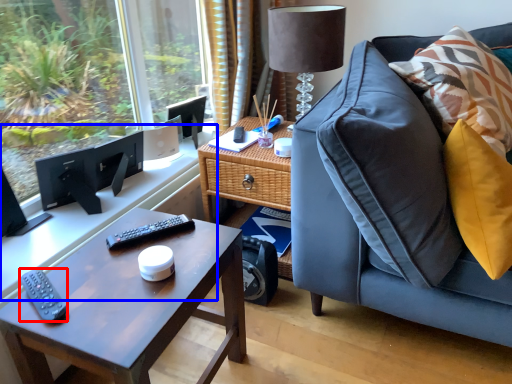
Question: Which of the following is the farthest to the observer, remote (highlighted by a red box) or computer desk (highlighted by a blue box)?

Choices:
 (A) remote
 (B) computer desk

Answer: (B)